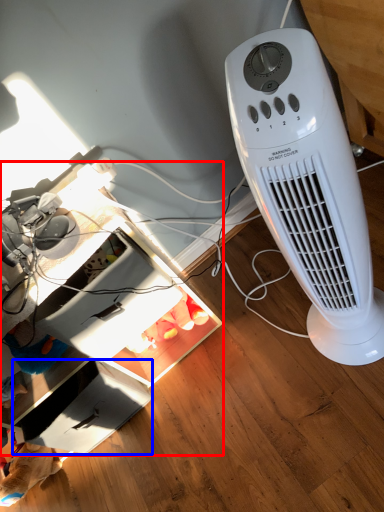
Question: Which object appears farthest to the camera in this image, computer desk (highlighted by a red box) or drawer (highlighted by a blue box)?

Choices:
 (A) computer desk
 (B) drawer

Answer: (B)